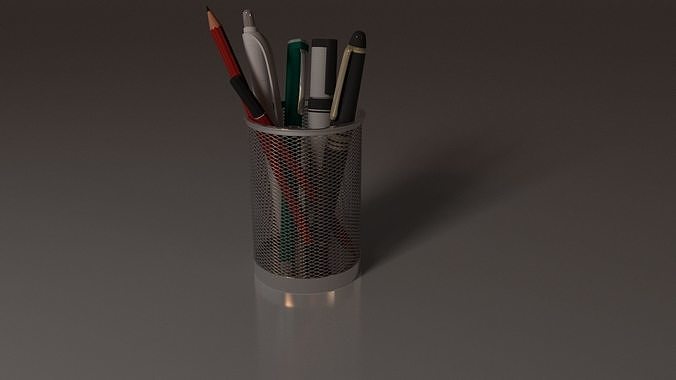
Image resolution: width=676 pixels, height=380 pixels. What are the coordinates of `pens` in the screenshot? It's located at (345, 80), (324, 71), (299, 71), (262, 63).